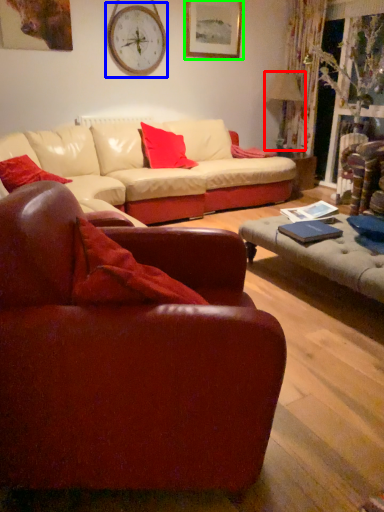
Question: Based on their relative distances, which object is farther from lamp (highlighted by a red box)? Choose from clock (highlighted by a blue box) and picture frame (highlighted by a green box).

Choices:
 (A) clock
 (B) picture frame

Answer: (A)